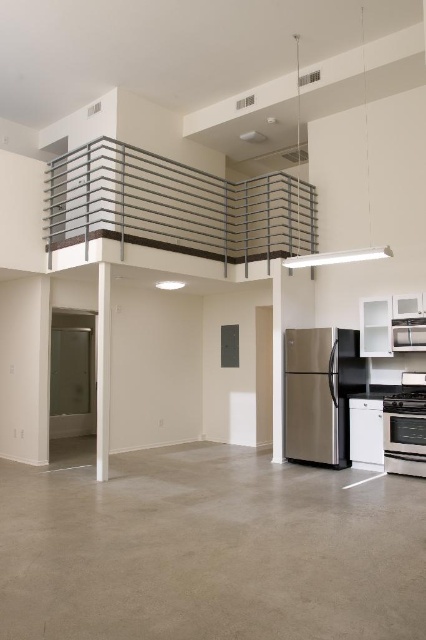
Question: Where is metallic silver balustrade at upper center located in relation to satin stainless steel oven at lower right in the image?

Choices:
 (A) below
 (B) above

Answer: (B)

Question: Can you confirm if metallic silver balustrade at upper center is positioned above stainless steel refrigerator at right?

Choices:
 (A) no
 (B) yes

Answer: (B)

Question: Which point is closer to the camera?

Choices:
 (A) satin stainless steel oven at lower right
 (B) stainless steel refrigerator at right

Answer: (A)

Question: Which is farther from the stainless steel refrigerator at right?

Choices:
 (A) satin stainless steel oven at lower right
 (B) metallic silver balustrade at upper center

Answer: (B)

Question: Does stainless steel refrigerator at right appear on the left side of satin stainless steel oven at lower right?

Choices:
 (A) yes
 (B) no

Answer: (A)

Question: Which point appears closest to the camera in this image?

Choices:
 (A) (402, 460)
 (B) (327, 442)

Answer: (A)